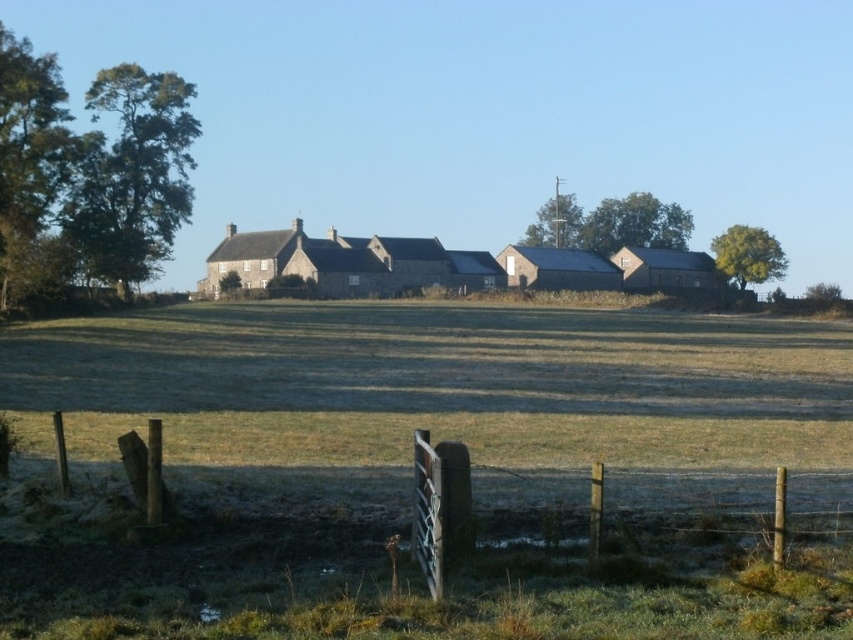
Between point (525, 288) and point (641, 285), which one is positioned behind?

The point (641, 285) is behind.

Between point (604, 268) and point (709, 273), which one is positioned in front?

Point (604, 268)

You are a GUI agent. You are given a task and a screenshot of the screen. Output one action in this format:
    pyautogui.click(x=<x>, y=<y>)
    Task: Click on the smooth gray barn at center
    This screenshot has height=640, width=853.
    Given the screenshot: What is the action you would take?
    pyautogui.click(x=558, y=268)

Which is more to the right, wooden gate at lower center or smooth gray barn at center?

smooth gray barn at center is more to the right.

Does point (386, 504) come behind point (521, 266)?

No.

Measure the distance between wooden gate at lower center and camera.

They are 39.80 feet apart.

The image size is (853, 640). Find the location of `wooden gate at lower center`. wooden gate at lower center is located at coordinates (300, 488).

Does wooden gate at center appear under smooth gray barn at center?

Indeed, wooden gate at center is positioned under smooth gray barn at center.

Is point (529, 524) more distant than point (525, 262)?

No, (529, 524) is in front of (525, 262).

The image size is (853, 640). What are the coordinates of `wooden gate at center` in the screenshot? It's located at (607, 508).